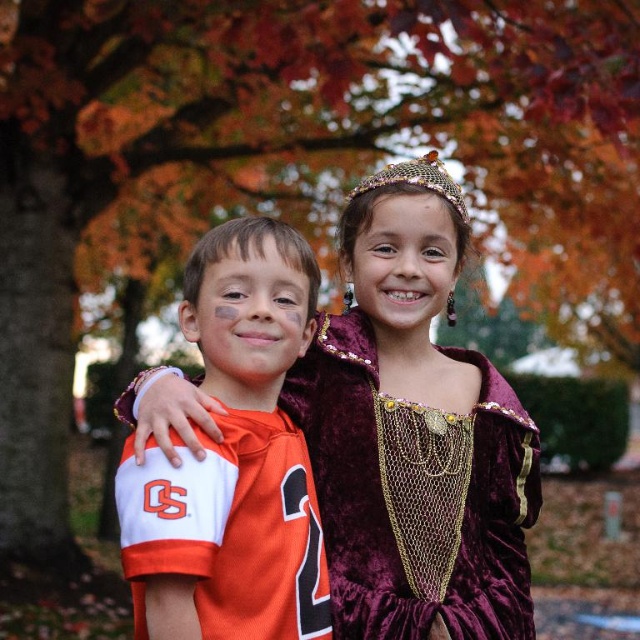
Can you confirm if orange jersey at center is positioned to the right of gold mesh crown at upper center?

Incorrect, orange jersey at center is not on the right side of gold mesh crown at upper center.

Which is behind, point (320, 608) or point (442, 189)?

Positioned behind is point (442, 189).

Where is `orange jersey at center`? The image size is (640, 640). orange jersey at center is located at coordinates (234, 460).

Which of these two, velvet maroon dress at center or gold mesh crown at upper center, stands shorter?

gold mesh crown at upper center is shorter.

Between velvet maroon dress at center and gold mesh crown at upper center, which one has more height?

velvet maroon dress at center is taller.

Describe the element at coordinates (413, 440) in the screenshot. I see `velvet maroon dress at center` at that location.

Find the location of a particular element. The image size is (640, 640). velvet maroon dress at center is located at coordinates (413, 440).

Between point (403, 452) and point (202, 308), which one is positioned in front?

Point (202, 308) is more forward.

Does velvet maroon dress at center have a greater width compared to orange jersey at center?

Yes, velvet maroon dress at center is wider than orange jersey at center.

Does point (333, 353) come closer to viewer compared to point (131, 454)?

No, (333, 353) is further to viewer.

Locate an element on the screen. velvet maroon dress at center is located at coordinates (413, 440).